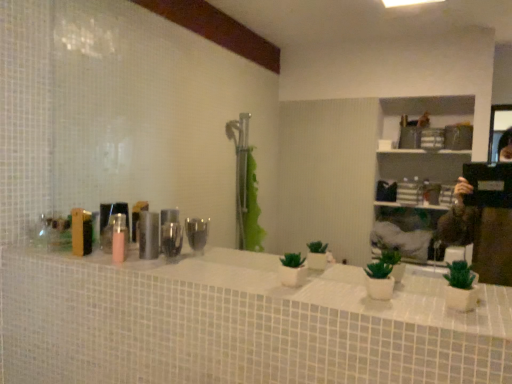
This screenshot has width=512, height=384. What are the coordinates of `vacant space to the right of wooden box at left, arranged as the second toiletry when viewed from the right` in the screenshot? It's located at tap(119, 263).